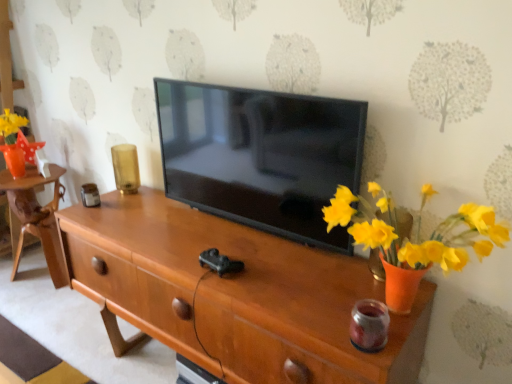
Question: Does wooden table at left lie in front of wooden tv stand at center?

Choices:
 (A) no
 (B) yes

Answer: (A)

Question: From a real-world perspective, is wooden table at left over wooden tv stand at center?

Choices:
 (A) no
 (B) yes

Answer: (A)

Question: Considering the relative sizes of wooden table at left and wooden tv stand at center in the image provided, is wooden table at left smaller than wooden tv stand at center?

Choices:
 (A) yes
 (B) no

Answer: (A)

Question: From the image's perspective, is wooden table at left on wooden tv stand at center?

Choices:
 (A) no
 (B) yes

Answer: (B)

Question: Does wooden table at left turn towards wooden tv stand at center?

Choices:
 (A) no
 (B) yes

Answer: (A)

Question: Looking at the image, does wooden tv stand at center seem bigger or smaller compared to black glossy tv at center?

Choices:
 (A) big
 (B) small

Answer: (A)

Question: From a real-world perspective, relative to black glossy tv at center, is wooden tv stand at center vertically above or below?

Choices:
 (A) below
 (B) above

Answer: (A)

Question: From the image's perspective, relative to black glossy tv at center, is wooden tv stand at center above or below?

Choices:
 (A) above
 (B) below

Answer: (B)

Question: Is wooden tv stand at center to the left or to the right of black glossy tv at center in the image?

Choices:
 (A) right
 (B) left

Answer: (B)

Question: From a real-world perspective, is black glossy tv at center physically located above or below wooden tv stand at center?

Choices:
 (A) below
 (B) above

Answer: (B)

Question: Looking at the image, does black glossy tv at center seem bigger or smaller compared to wooden tv stand at center?

Choices:
 (A) big
 (B) small

Answer: (B)

Question: Looking at their shapes, would you say black glossy tv at center is wider or thinner than wooden tv stand at center?

Choices:
 (A) wide
 (B) thin

Answer: (B)

Question: Is black glossy tv at center inside or outside of wooden tv stand at center?

Choices:
 (A) outside
 (B) inside

Answer: (A)

Question: In terms of size, does wooden cabinet at left appear bigger or smaller than wooden tv stand at center?

Choices:
 (A) small
 (B) big

Answer: (A)

Question: Is wooden cabinet at left inside or outside of wooden tv stand at center?

Choices:
 (A) inside
 (B) outside

Answer: (B)